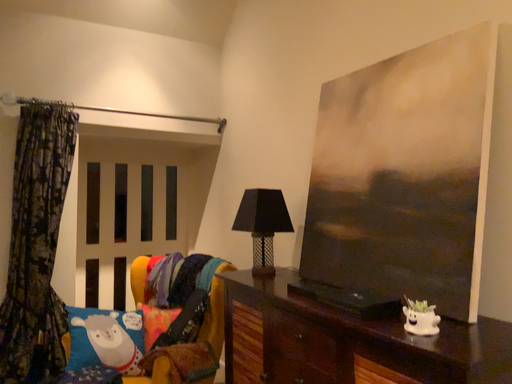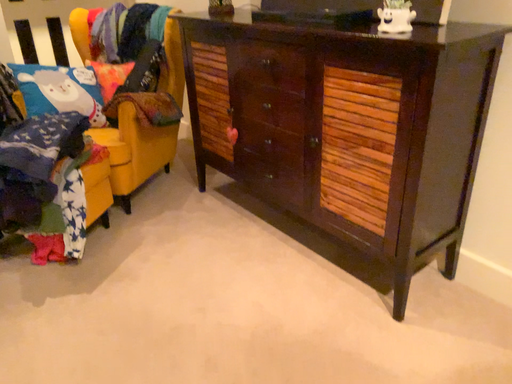
Question: How did the camera likely rotate when shooting the video?

Choices:
 (A) rotated upward
 (B) rotated downward

Answer: (B)